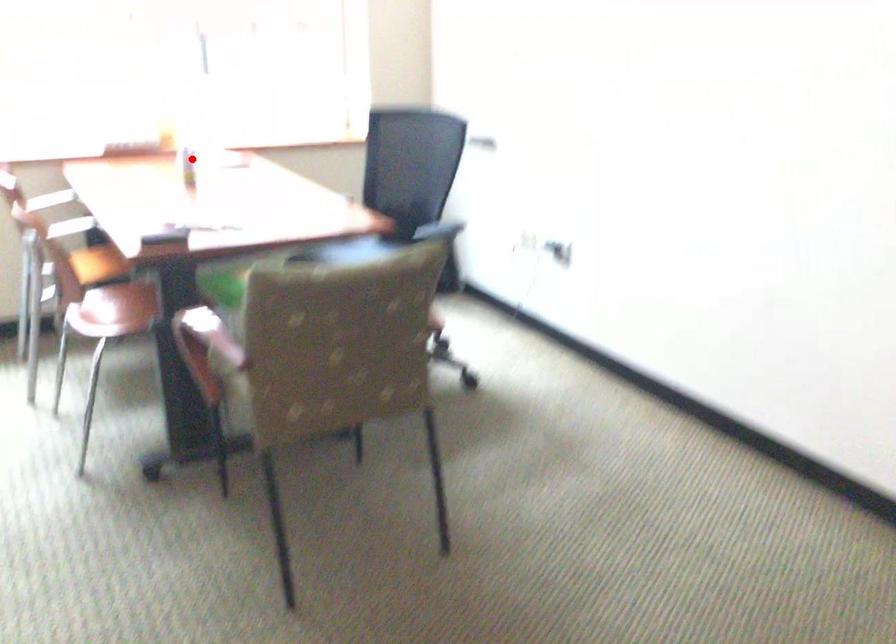
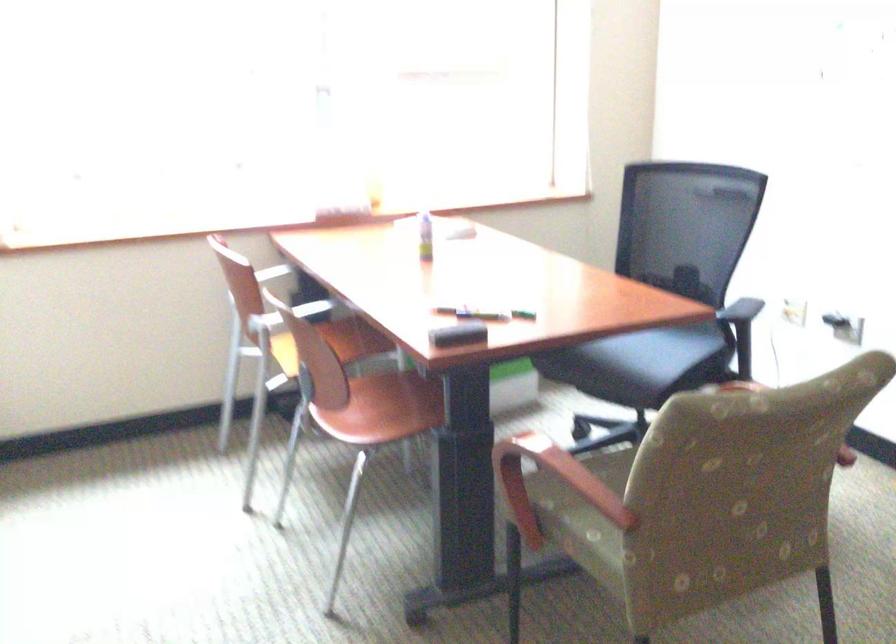
Question: I am providing you with two images of the same scene from different viewpoints. Given a red point in image1, look at the same physical point in image2. Is it:

Choices:
 (A) Closer to the viewpoint
 (B) Farther from the viewpoint

Answer: (A)